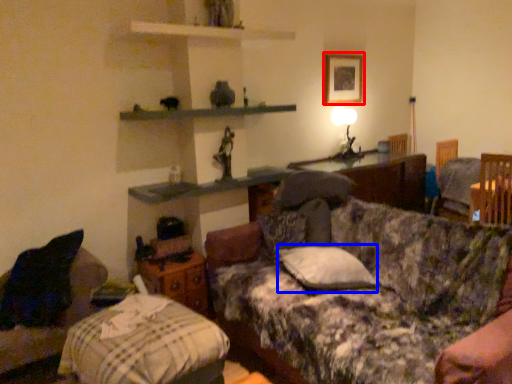
Question: Among these objects, which one is nearest to the camera, picture frame (highlighted by a red box) or pillow (highlighted by a blue box)?

Choices:
 (A) picture frame
 (B) pillow

Answer: (B)